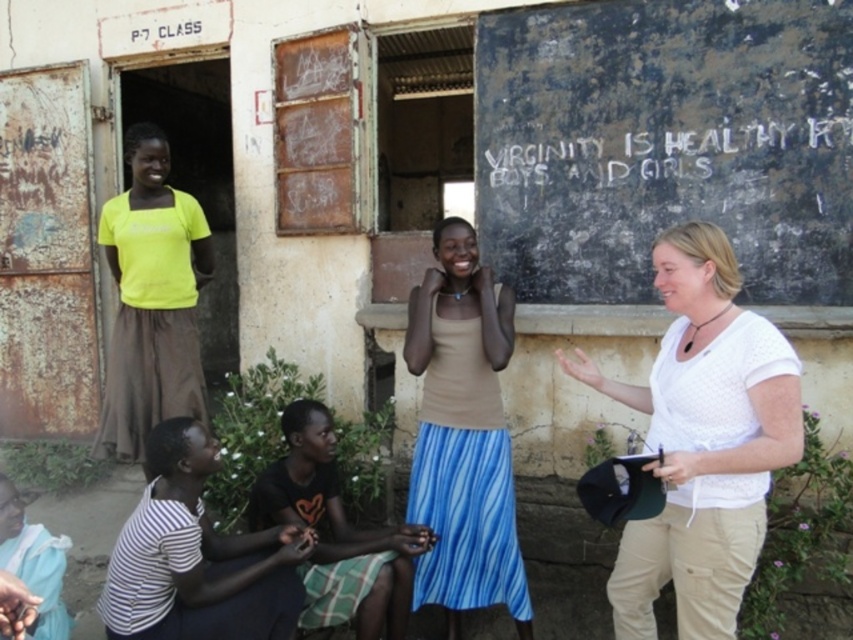
Measure the distance between point (x=462, y=492) and camera.

The distance of point (x=462, y=492) from camera is 12.06 feet.

The width and height of the screenshot is (853, 640). What do you see at coordinates (463, 435) in the screenshot? I see `matte beige tank top at center` at bounding box center [463, 435].

Identify the location of matte beige tank top at center. (463, 435).

Who is positioned more to the right, white textured shirt at center or light blue fabric at lower left?

white textured shirt at center

Which of these two, white textured shirt at center or light blue fabric at lower left, stands shorter?

light blue fabric at lower left is shorter.

Where is `white textured shirt at center`? The image size is (853, 640). white textured shirt at center is located at coordinates (701, 440).

Is white textured shirt at center thinner than white striped shirt at lower left?

Indeed, white textured shirt at center has a lesser width compared to white striped shirt at lower left.

Who is more forward, (729, 620) or (126, 609)?

Point (729, 620) is more forward.

Identify the location of white textured shirt at center. The height and width of the screenshot is (640, 853). (701, 440).